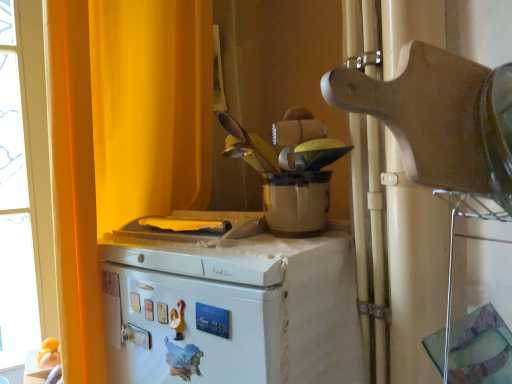
This screenshot has width=512, height=384. What are the coordinates of `free space to the left of matte white pot at center, the first appliance positioned from the back` in the screenshot? It's located at (174, 240).